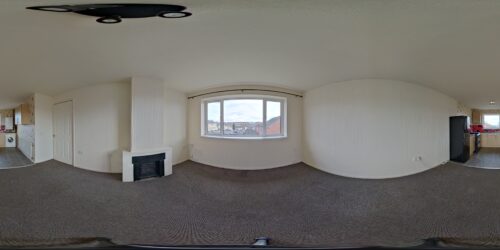
Where is `white cabinets`? white cabinets is located at coordinates (491, 139), (474, 144).